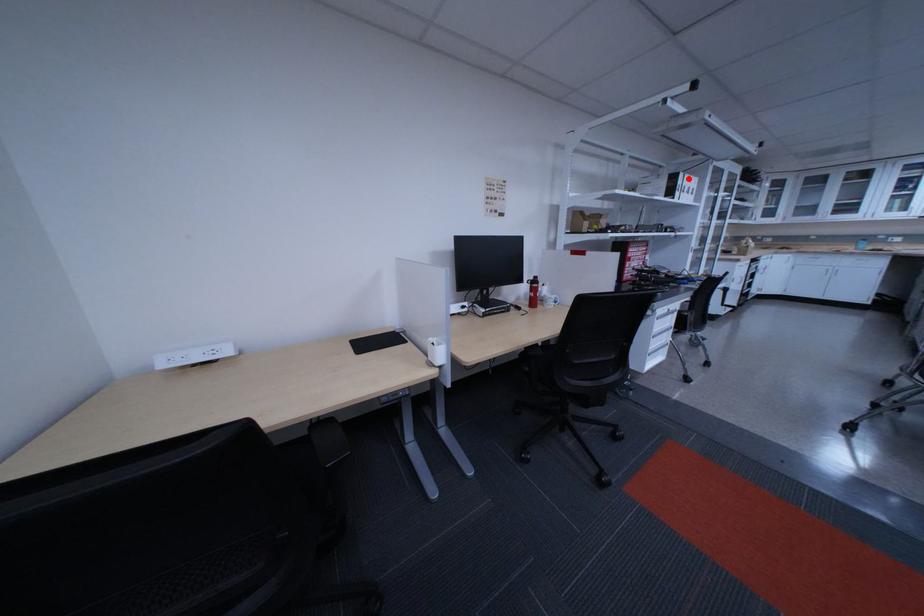
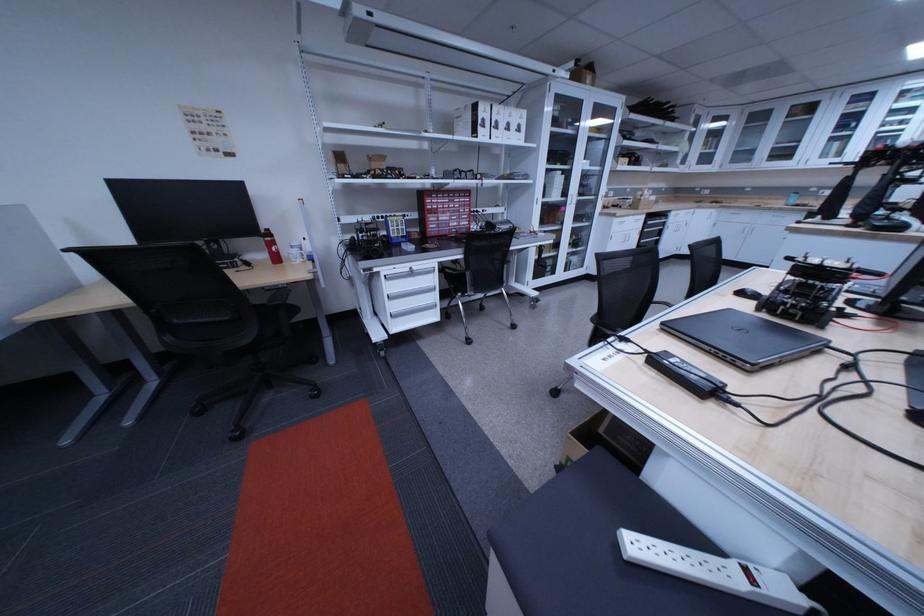
Locate, in the second image, the point that corresponds to the highlighted location in the first image.

(490, 110)